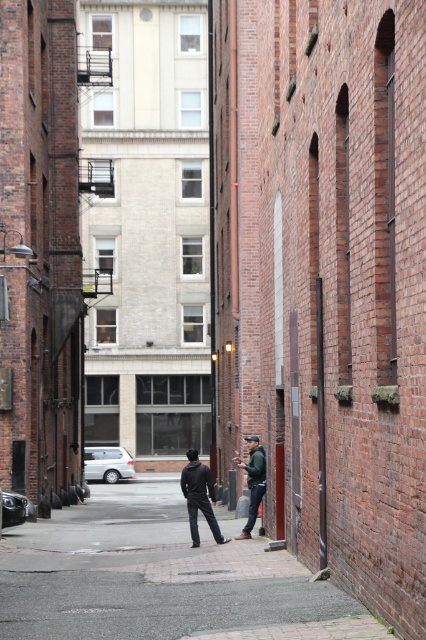
Question: Is dark gray asphalt at center bigger than green fabric jacket at center?

Choices:
 (A) yes
 (B) no

Answer: (A)

Question: Considering the real-world distances, which object is farthest from the black matte jacket at center?

Choices:
 (A) green fabric jacket at center
 (B) dark gray asphalt at center

Answer: (B)

Question: Where is dark gray asphalt at center located in relation to green fabric jacket at center in the image?

Choices:
 (A) left
 (B) right

Answer: (A)

Question: Which object is farther from the camera taking this photo?

Choices:
 (A) green fabric jacket at center
 (B) black matte jacket at center

Answer: (A)

Question: Among these points, which one is farthest from the camera?

Choices:
 (A) (253, 634)
 (B) (261, 484)

Answer: (B)

Question: Can you confirm if dark gray asphalt at center is wider than black matte jacket at center?

Choices:
 (A) yes
 (B) no

Answer: (A)